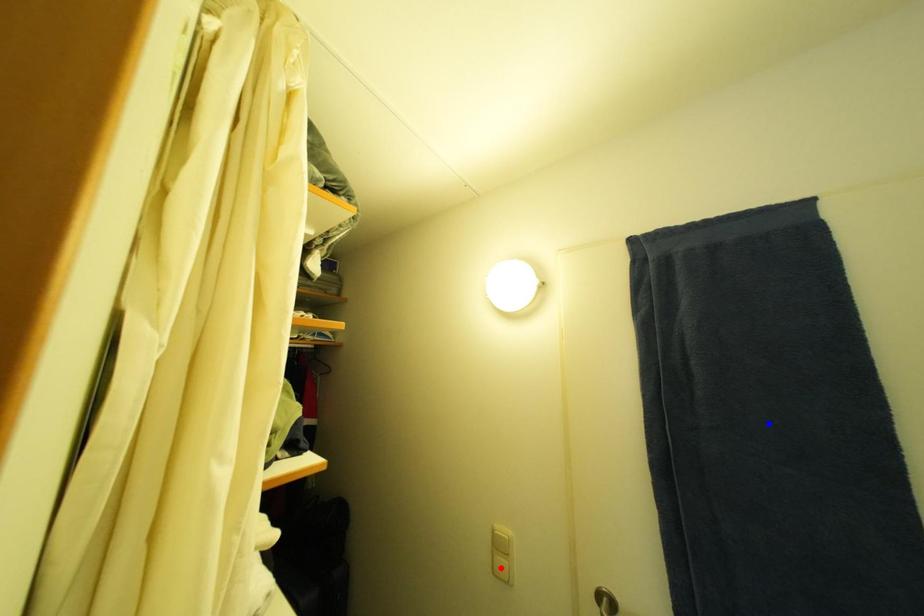
Question: In the image, two points are highlighted. Which point is nearer to the camera? Reply with the corresponding letter.

Choices:
 (A) blue point
 (B) red point

Answer: (A)